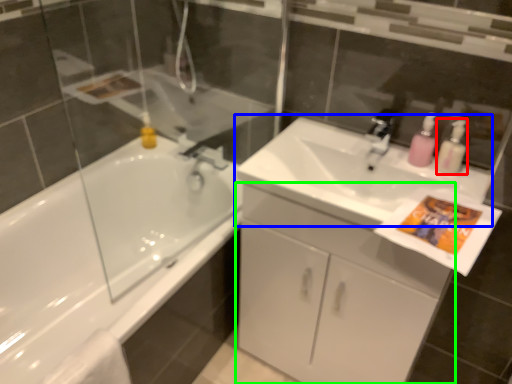
Question: Considering the real-world distances, which object is closest to cleaning product (highlighted by a red box)? sink (highlighted by a blue box) or bathroom cabinet (highlighted by a green box).

Choices:
 (A) sink
 (B) bathroom cabinet

Answer: (A)